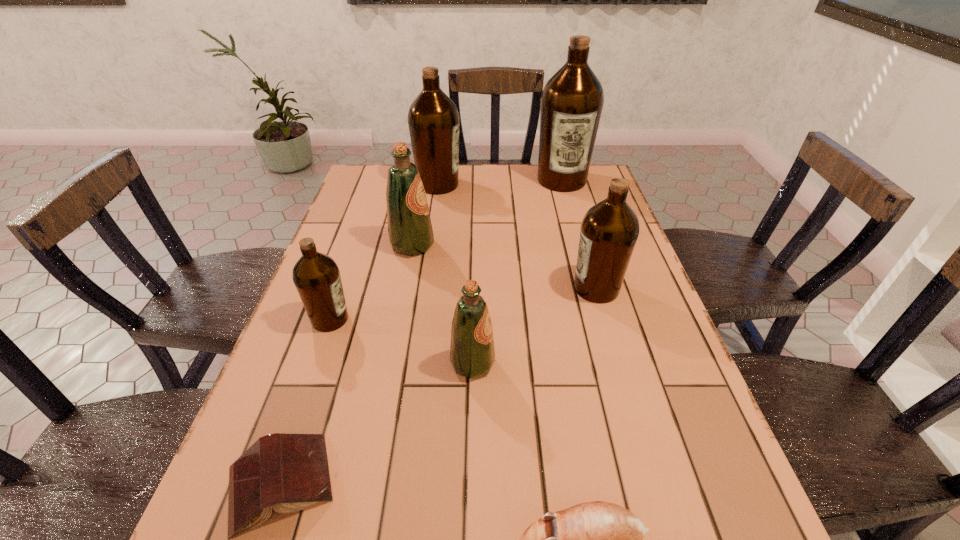
Find the location of a particular element. empty space that is in between the biggest brown olive oil and the second smallest brown olive oil is located at coordinates (579, 234).

Select which object appears as the closest to the shortest object. Please provide its 2D coordinates. Your answer should be formatted as a tuple, i.e. [(x, y)], where the tuple contains the x and y coordinates of a point satisfying the conditions above.

[(472, 354)]

Find the location of `object that ranks as the seventh closest to the second biggest brown olive oil`. object that ranks as the seventh closest to the second biggest brown olive oil is located at coordinates (x=597, y=539).

You are a GUI agent. You are given a task and a screenshot of the screen. Output one action in this format:
    pyautogui.click(x=<x>, y=<y>)
    Task: Click on the olive oil that is the second closest to the bigger green olive oil
    The height and width of the screenshot is (540, 960).
    Given the screenshot: What is the action you would take?
    pyautogui.click(x=433, y=119)

Select which olive oil is the fourth closest to the second brown olive oil from left to right. Please provide its 2D coordinates. Your answer should be formatted as a tuple, i.e. [(x, y)], where the tuple contains the x and y coordinates of a point satisfying the conditions above.

[(316, 276)]

Identify which brown olive oil is the fourth nearest to the left green olive oil. Please provide its 2D coordinates. Your answer should be formatted as a tuple, i.e. [(x, y)], where the tuple contains the x and y coordinates of a point satisfying the conditions above.

[(572, 100)]

Choose which brown olive oil is the third nearest neighbor to the second smallest brown olive oil. Please provide its 2D coordinates. Your answer should be formatted as a tuple, i.e. [(x, y)], where the tuple contains the x and y coordinates of a point satisfying the conditions above.

[(316, 276)]

Identify the location of vacant point that satisfies the following two spatial constraints: 1. on the label of the tallest olive oil; 2. on the label of the third brown olive oil from right to left. (563, 185).

I want to click on vacant space that satisfies the following two spatial constraints: 1. on the label of the biggest brown olive oil; 2. on the label of the second biggest brown olive oil, so click(563, 185).